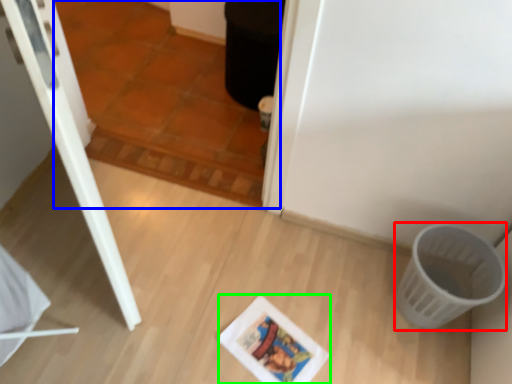
Question: Which is nearer to the basket (highlighted by a red box)? tile (highlighted by a blue box) or comic book (highlighted by a green box).

Choices:
 (A) tile
 (B) comic book

Answer: (B)